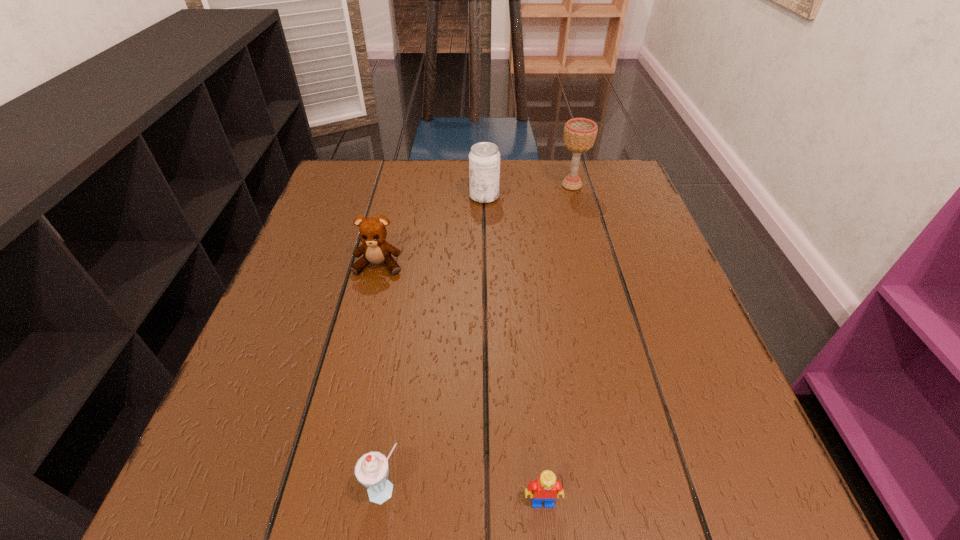
Image resolution: width=960 pixels, height=540 pixels. I want to click on vacant position located 0.110m on the front-facing side of the leftmost object, so click(x=366, y=319).

This screenshot has height=540, width=960. In order to click on chalice located in the far edge section of the desktop in this screenshot , I will do `click(580, 134)`.

Find the location of a particular element. The height and width of the screenshot is (540, 960). soda can that is at the far edge is located at coordinates (484, 158).

This screenshot has height=540, width=960. I want to click on milkshake present at the near edge, so tap(371, 470).

The height and width of the screenshot is (540, 960). Find the location of `Lego that is at the near edge`. Lego that is at the near edge is located at coordinates (546, 488).

Find the location of a particular element. The image size is (960, 540). object situated at the left edge is located at coordinates (375, 250).

At what (x,y) coordinates should I click in order to perform the action: click on object present at the right edge. Please return your answer as a coordinate pair (x, y). The width and height of the screenshot is (960, 540). Looking at the image, I should click on (580, 134).

I want to click on object present at the far right corner, so click(x=580, y=134).

Locate an element on the screen. This screenshot has width=960, height=540. free space at the far edge of the desktop is located at coordinates [x=515, y=191].

Locate an element on the screen. vacant area at the left edge is located at coordinates (302, 345).